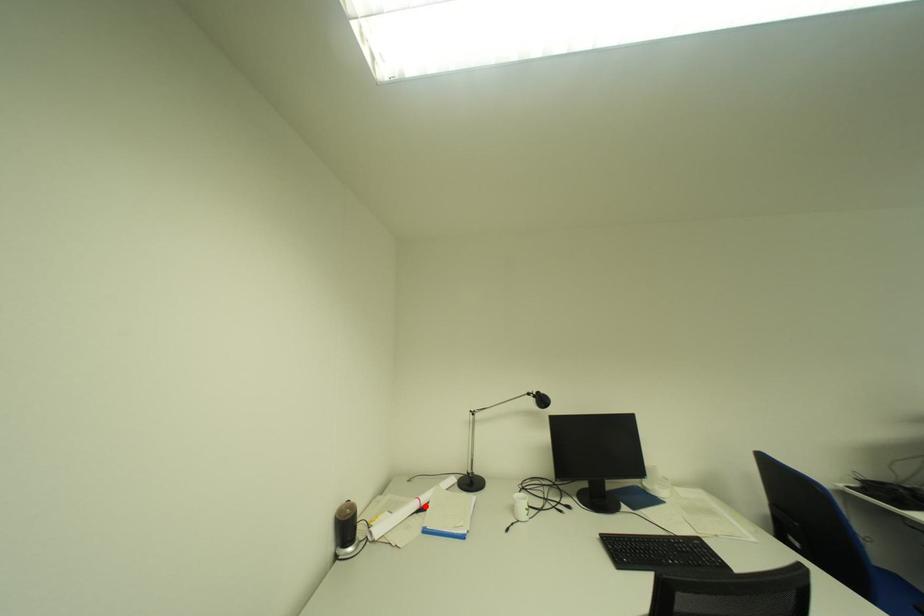
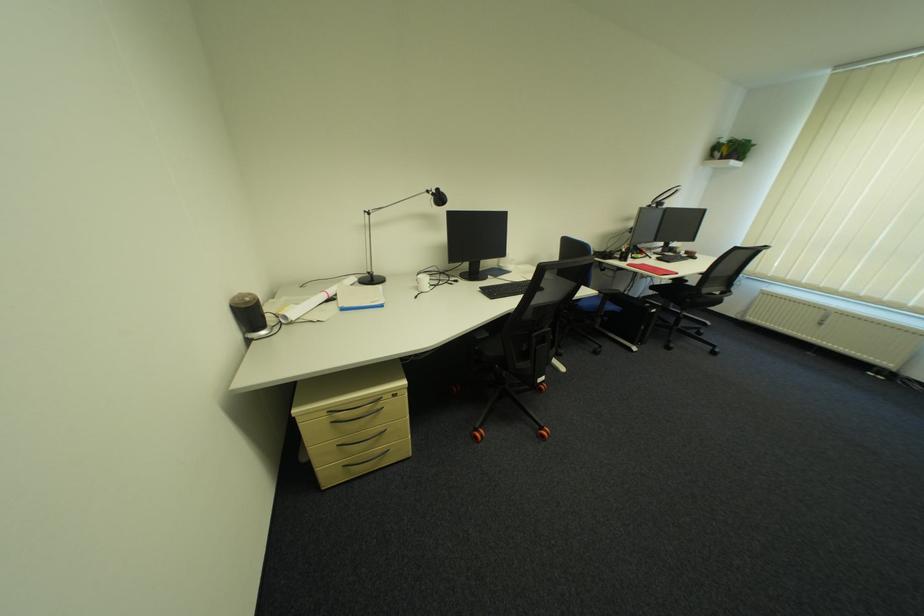
Find the pixel in the second image that matches the highlighted location in the first image.

(334, 298)